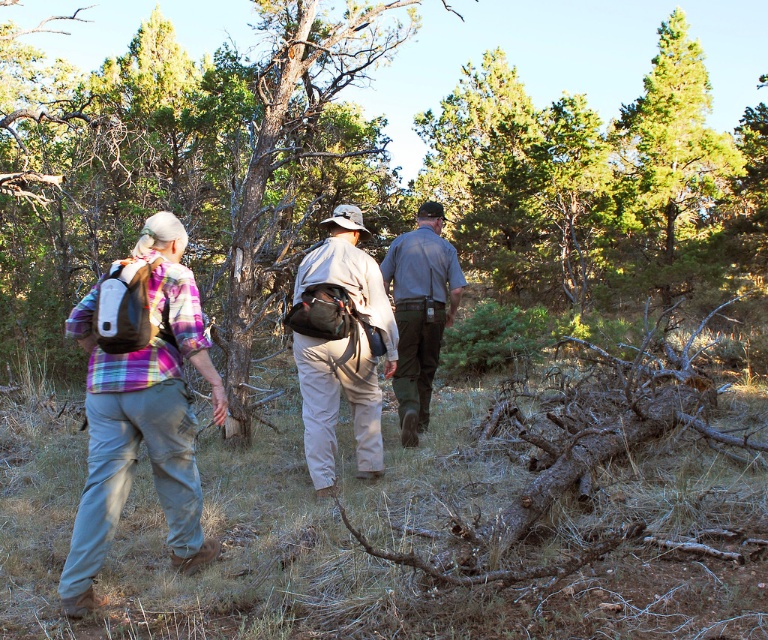
You are a hiker trying to reach a hidden spring located at point (74, 602). Your GPS shows that the spring is 11.11 feet away from your current position. If you walk straight towards it, will you encounter any obstacles like fallen logs or steep drops based on the scene description?

The scene mentions scattered patches of greenery and a few fallen tree trunks lying on the ground, but the exact location of these obstacles relative to point (74, 602) is not specified. Therefore, it is possible there could be obstacles like fallen logs in your path, so proceed with caution.

You are a hiker trying to identify clothing items in the scene. Which item, the plaid fabric shirt at center or the khaki cotton pants at center, is taller?

The plaid fabric shirt at center is taller than the khaki cotton pants at center.

You are a hiker who wants to identify the person wearing the plaid fabric shirt at center and the gray uniform pants at center. Based on their clothing, which one is positioned to the left?

The plaid fabric shirt at center is to the left of the gray uniform pants at center.